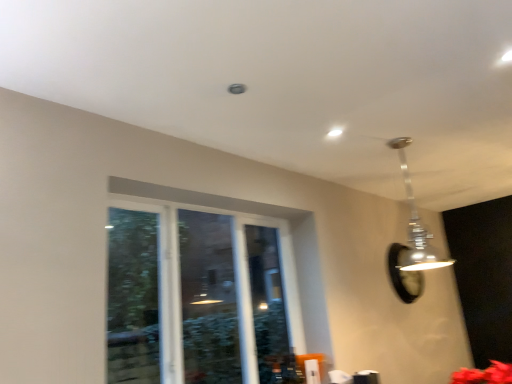
Question: Is metallic silver pendant light at upper right to the left of clear glass window at center from the viewer's perspective?

Choices:
 (A) yes
 (B) no

Answer: (B)

Question: Does metallic silver pendant light at upper right have a lesser height compared to clear glass window at center?

Choices:
 (A) no
 (B) yes

Answer: (B)

Question: Could you tell me if metallic silver pendant light at upper right is facing clear glass window at center?

Choices:
 (A) no
 (B) yes

Answer: (A)

Question: Is metallic silver pendant light at upper right facing away from clear glass window at center?

Choices:
 (A) no
 (B) yes

Answer: (A)

Question: Are metallic silver pendant light at upper right and clear glass window at center making contact?

Choices:
 (A) yes
 (B) no

Answer: (B)

Question: From the image's perspective, is metallic silver pendant light at upper right on clear glass window at center?

Choices:
 (A) yes
 (B) no

Answer: (A)

Question: Does black glass mirror at upper right have a lesser height compared to clear glass window at center?

Choices:
 (A) yes
 (B) no

Answer: (A)

Question: Are black glass mirror at upper right and clear glass window at center making contact?

Choices:
 (A) no
 (B) yes

Answer: (A)

Question: From a real-world perspective, is black glass mirror at upper right physically above clear glass window at center?

Choices:
 (A) no
 (B) yes

Answer: (B)

Question: Is black glass mirror at upper right to the right of clear glass window at center from the viewer's perspective?

Choices:
 (A) no
 (B) yes

Answer: (B)

Question: Is black glass mirror at upper right far away from clear glass window at center?

Choices:
 (A) no
 (B) yes

Answer: (B)

Question: Is black glass mirror at upper right aimed at clear glass window at center?

Choices:
 (A) yes
 (B) no

Answer: (B)

Question: Does clear glass window at center have a lesser height compared to black glass mirror at upper right?

Choices:
 (A) yes
 (B) no

Answer: (B)